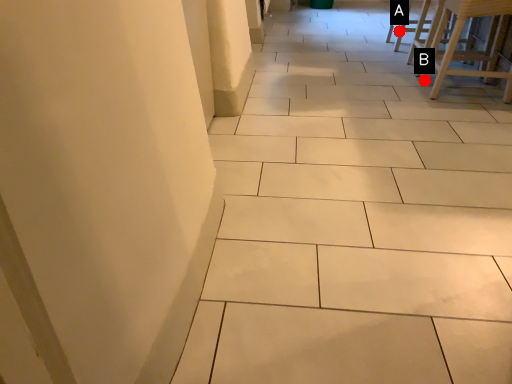
Question: Two points are circled on the image, labeled by A and B beside each circle. Which point is farther from the camera taking this photo?

Choices:
 (A) A is further
 (B) B is further

Answer: (A)